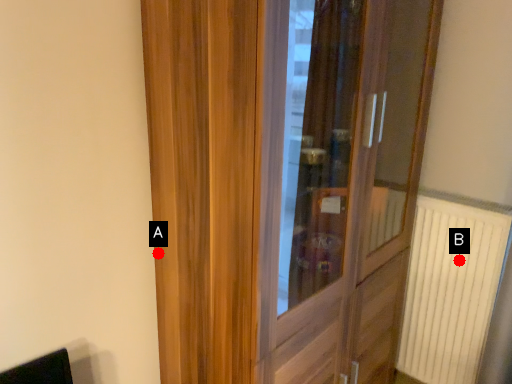
Question: Two points are circled on the image, labeled by A and B beside each circle. Which point is further to the camera?

Choices:
 (A) A is further
 (B) B is further

Answer: (B)